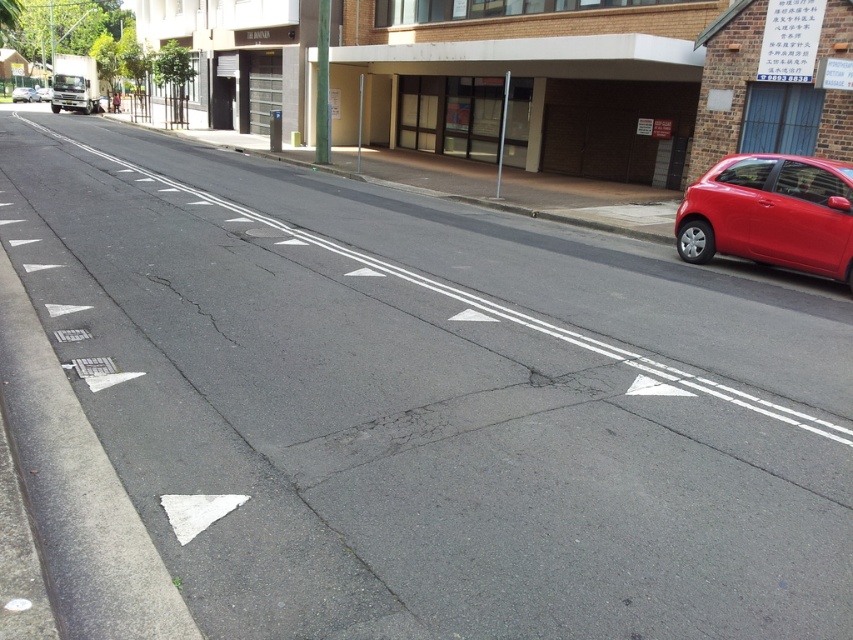
Question: Is shiny red hatchback at right behind metallic silver car at center?

Choices:
 (A) no
 (B) yes

Answer: (A)

Question: Which of the following is the farthest from the observer?

Choices:
 (A) metallic silver car at center
 (B) red glossy hatchback at right

Answer: (B)

Question: Does shiny red hatchback at right appear on the left side of metallic silver car at center?

Choices:
 (A) yes
 (B) no

Answer: (B)

Question: Which point is closer to the camera taking this photo?

Choices:
 (A) (780, 193)
 (B) (41, 92)
 (C) (35, 90)

Answer: (A)

Question: Is shiny red hatchback at right above metallic silver car at center?

Choices:
 (A) yes
 (B) no

Answer: (B)

Question: Which point is closer to the camera taking this photo?

Choices:
 (A) (717, 212)
 (B) (42, 92)

Answer: (A)